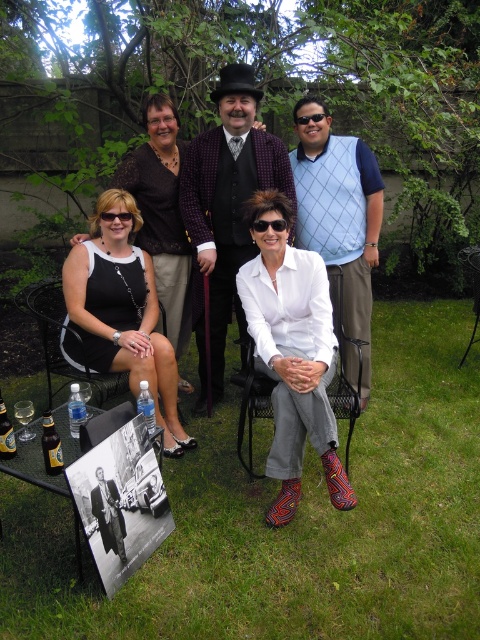
In the scene shown: You are standing at the camera position and want to throw a small ball to the point marked as point (321, 125). Can you estimate how far you need to throw the ball?

The distance between point (321, 125) and the camera is 3.42 meters, so you need to throw the ball approximately 3.42 meters.

You are a photographer trying to capture both the matte black sunglasses at upper left and the transparent plastic goggles at center in a single frame. Considering their sizes, which object should you focus on to ensure both fit in the frame without cropping?

Since the matte black sunglasses at upper left occupies less space than transparent plastic goggles at center, you should focus on the transparent plastic goggles at center to ensure both objects fit in the frame without cropping.